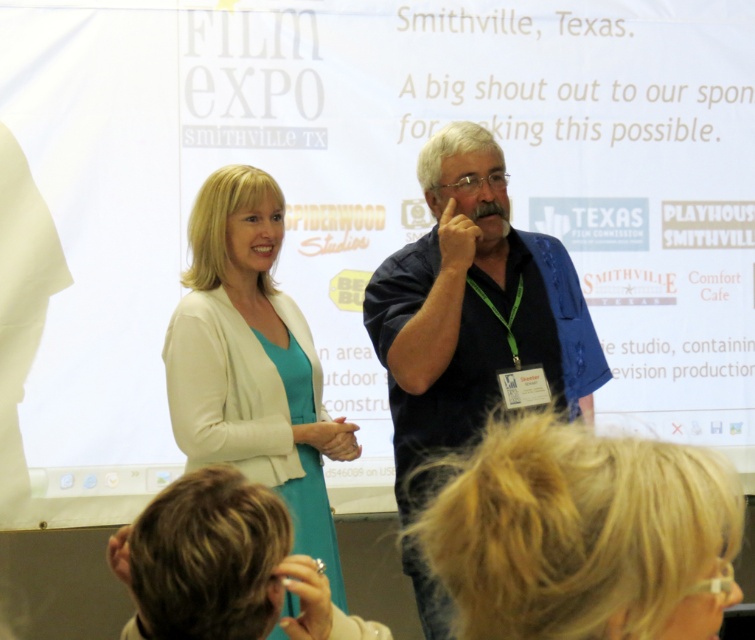
Question: Does blue cotton shirt at center come behind matte white blazer at center?

Choices:
 (A) yes
 (B) no

Answer: (A)

Question: Which point appears farthest from the camera in this image?

Choices:
 (A) (267, 378)
 (B) (455, 148)

Answer: (B)

Question: Which point is farther to the camera?

Choices:
 (A) (424, 595)
 (B) (341, 605)

Answer: (A)

Question: Is blue cotton shirt at center bigger than matte white blazer at center?

Choices:
 (A) no
 (B) yes

Answer: (B)

Question: Does blue cotton shirt at center come behind matte white blazer at center?

Choices:
 (A) no
 (B) yes

Answer: (B)